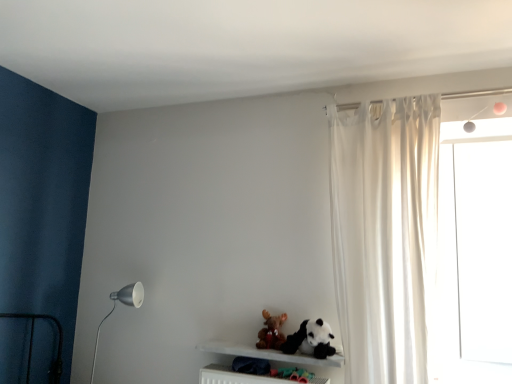
Identify the location of black plush panda at lower center, the 1th toy from the right. (311, 340).

At what (x,y) coordinates should I click in order to perform the action: click on matte white metal floor lamp at left. Please return your answer as a coordinate pair (x, y). This screenshot has height=384, width=512. Looking at the image, I should click on (115, 307).

This screenshot has width=512, height=384. Find the location of `white sheer curtain at right`. white sheer curtain at right is located at coordinates (386, 237).

Locate an element on the screen. black plush panda at lower center, the 1th toy from the right is located at coordinates (311, 340).

This screenshot has height=384, width=512. Find the location of `curtain in front of the transparent glass window at right`. curtain in front of the transparent glass window at right is located at coordinates (386, 237).

Measure the distance between transparent glass window at right and white sheer curtain at right.

transparent glass window at right and white sheer curtain at right are 20.90 inches apart from each other.

Considering the sizes of objects transparent glass window at right and white sheer curtain at right in the image provided, who is wider, transparent glass window at right or white sheer curtain at right?

Wider between the two is white sheer curtain at right.

Can you confirm if transparent glass window at right is taller than white sheer curtain at right?

Incorrect, the height of transparent glass window at right is not larger of that of white sheer curtain at right.

This screenshot has height=384, width=512. I want to click on window frame on the right of brown plush toy at center, placed as the 2th toy when sorted from right to left, so click(476, 251).

Is point (277, 340) closer or farther from the camera than point (446, 300)?

Clearly, point (277, 340) is closer to the camera than point (446, 300).

Which of these two, brown plush toy at center, placed as the 2th toy when sorted from right to left, or transparent glass window at right, is thinner?

transparent glass window at right.

Is brown plush toy at center, placed as the 2th toy when sorted from right to left, further to camera compared to transparent glass window at right?

Yes, the depth of brown plush toy at center, placed as the 2th toy when sorted from right to left, is greater than that of transparent glass window at right.

How far apart are white matte shelf at lower center and transparent glass window at right?

white matte shelf at lower center and transparent glass window at right are 3.44 feet apart.

Considering the positions of objects white matte shelf at lower center and transparent glass window at right in the image provided, who is in front, white matte shelf at lower center or transparent glass window at right?

white matte shelf at lower center.

Considering the sizes of white matte shelf at lower center and transparent glass window at right in the image, is white matte shelf at lower center taller or shorter than transparent glass window at right?

Clearly, white matte shelf at lower center is shorter compared to transparent glass window at right.

Is white matte shelf at lower center positioned beyond the bounds of transparent glass window at right?

Yes, white matte shelf at lower center is outside of transparent glass window at right.

Looking at their sizes, would you say black plush panda at lower center, the 1th toy from the right, is wider or thinner than white sheer curtain at right?

black plush panda at lower center, the 1th toy from the right, is thinner than white sheer curtain at right.

Starting from the white sheer curtain at right, which toy is the 1st one behind? Please provide its 2D coordinates.

[(311, 340)]

How many degrees apart are the facing directions of black plush panda at lower center, the 1th toy from the right, and white sheer curtain at right?

black plush panda at lower center, the 1th toy from the right, and white sheer curtain at right are facing 4.35 degrees away from each other.

Which is correct: black plush panda at lower center, the 1th toy from the right, is inside white sheer curtain at right, or outside of it?

black plush panda at lower center, the 1th toy from the right, is spatially situated outside white sheer curtain at right.

Is black plush panda at lower center, positioned as the 2th toy in left-to-right order, positioned behind transparent glass window at right?

No, black plush panda at lower center, positioned as the 2th toy in left-to-right order, is in front of transparent glass window at right.

Consider the image. Could transparent glass window at right be considered to be inside black plush panda at lower center, positioned as the 2th toy in left-to-right order?

No, transparent glass window at right is not inside black plush panda at lower center, positioned as the 2th toy in left-to-right order.

Could you tell me if black plush panda at lower center, the 1th toy from the right, is facing transparent glass window at right?

No.

From the image's perspective, is black plush panda at lower center, the 1th toy from the right, beneath transparent glass window at right?

Correct, black plush panda at lower center, the 1th toy from the right, appears lower than transparent glass window at right in the image.

Is black plush panda at lower center, the 1th toy from the right, not close to brown plush toy at center, positioned as the first toy in left-to-right order?

No.

Is black plush panda at lower center, positioned as the 2th toy in left-to-right order, positioned with its back to brown plush toy at center, positioned as the first toy in left-to-right order?

No, black plush panda at lower center, positioned as the 2th toy in left-to-right order, is not facing the opposite direction of brown plush toy at center, positioned as the first toy in left-to-right order.

Is black plush panda at lower center, the 1th toy from the right, wider than brown plush toy at center, placed as the 2th toy when sorted from right to left?

Indeed, black plush panda at lower center, the 1th toy from the right, has a greater width compared to brown plush toy at center, placed as the 2th toy when sorted from right to left.

Is black plush panda at lower center, the 1th toy from the right, taller or shorter than brown plush toy at center, positioned as the first toy in left-to-right order?

In the image, black plush panda at lower center, the 1th toy from the right, appears to be taller than brown plush toy at center, positioned as the first toy in left-to-right order.

How far apart are white sheer curtain at right and black plush panda at lower center, the 1th toy from the right?

A distance of 20.32 inches exists between white sheer curtain at right and black plush panda at lower center, the 1th toy from the right.

Which of these two, white sheer curtain at right or black plush panda at lower center, the 1th toy from the right, stands taller?

white sheer curtain at right.

Does point (394, 230) appear closer or farther from the camera than point (305, 335)?

Point (394, 230) is closer to the camera than point (305, 335).

Is white sheer curtain at right at the right side of black plush panda at lower center, positioned as the 2th toy in left-to-right order?

Correct, you'll find white sheer curtain at right to the right of black plush panda at lower center, positioned as the 2th toy in left-to-right order.

Where is `window frame below the white sheer curtain at right (from the image's perspective)`? window frame below the white sheer curtain at right (from the image's perspective) is located at coordinates (476, 251).

The image size is (512, 384). Identify the location of window frame above the brown plush toy at center, placed as the 2th toy when sorted from right to left (from a real-world perspective). (476, 251).

Which object lies nearer to the anchor point transparent glass window at right, white matte shelf at lower center or black plush panda at lower center, positioned as the 2th toy in left-to-right order?

Among the two, black plush panda at lower center, positioned as the 2th toy in left-to-right order, is located nearer to transparent glass window at right.

From the image, which object appears to be nearer to transparent glass window at right, white sheer curtain at right or brown plush toy at center, placed as the 2th toy when sorted from right to left?

white sheer curtain at right is closer to transparent glass window at right.

Looking at the image, which one is located further to white matte shelf at lower center, matte white metal floor lamp at left or brown plush toy at center, placed as the 2th toy when sorted from right to left?

The object further to white matte shelf at lower center is matte white metal floor lamp at left.

Which object lies nearer to the anchor point white sheer curtain at right, black plush panda at lower center, positioned as the 2th toy in left-to-right order, or white matte shelf at lower center?

black plush panda at lower center, positioned as the 2th toy in left-to-right order, is positioned closer to the anchor white sheer curtain at right.

From the image, which object appears to be farther from black plush panda at lower center, the 1th toy from the right, transparent glass window at right or white matte shelf at lower center?

transparent glass window at right.

Considering their positions, is black plush panda at lower center, positioned as the 2th toy in left-to-right order, positioned closer to matte white metal floor lamp at left than white matte shelf at lower center?

white matte shelf at lower center lies closer to matte white metal floor lamp at left than the other object.

From the image, which object appears to be farther from brown plush toy at center, placed as the 2th toy when sorted from right to left, black plush panda at lower center, positioned as the 2th toy in left-to-right order, or white matte shelf at lower center?

black plush panda at lower center, positioned as the 2th toy in left-to-right order, is further to brown plush toy at center, placed as the 2th toy when sorted from right to left.

Looking at the image, which one is located closer to matte white metal floor lamp at left, brown plush toy at center, positioned as the first toy in left-to-right order, or white sheer curtain at right?

Based on the image, brown plush toy at center, positioned as the first toy in left-to-right order, appears to be nearer to matte white metal floor lamp at left.

I want to click on curtain between brown plush toy at center, positioned as the first toy in left-to-right order, and transparent glass window at right from left to right, so click(386, 237).

At what (x,y) coordinates should I click in order to perform the action: click on shelf between matte white metal floor lamp at left and black plush panda at lower center, positioned as the 2th toy in left-to-right order, in the horizontal direction. Please return your answer as a coordinate pair (x, y). Looking at the image, I should click on (269, 354).

You are a GUI agent. You are given a task and a screenshot of the screen. Output one action in this format:
    pyautogui.click(x=<x>, y=<y>)
    Task: Click on the toy between white sheer curtain at right and brown plush toy at center, positioned as the first toy in left-to-right order, in the vertical direction
    This screenshot has width=512, height=384.
    Given the screenshot: What is the action you would take?
    pyautogui.click(x=311, y=340)

Find the location of a particular element. The height and width of the screenshot is (384, 512). toy located between white matte shelf at lower center and black plush panda at lower center, the 1th toy from the right, in the left-right direction is located at coordinates (271, 331).